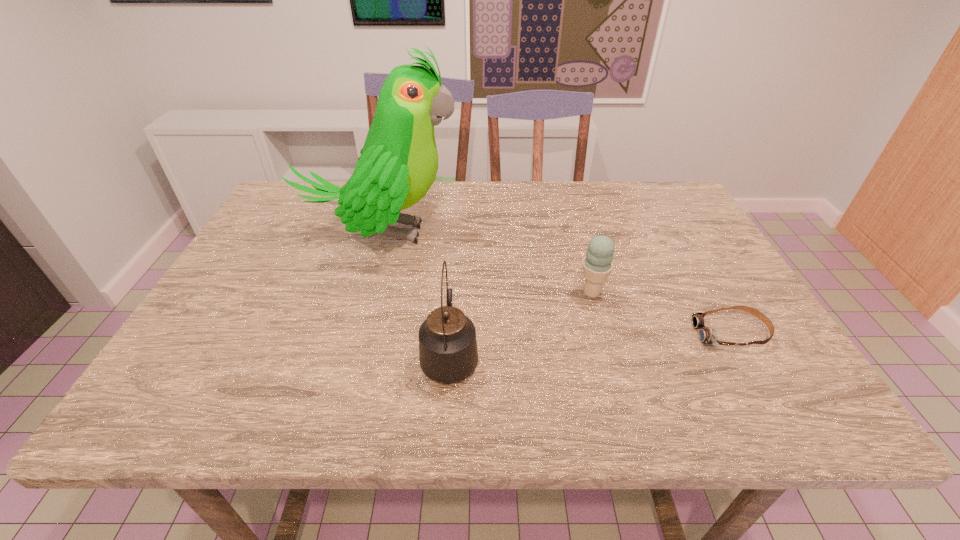
This screenshot has width=960, height=540. Find the location of `vacant space that's between the rightmost object and the second object from right to left`. vacant space that's between the rightmost object and the second object from right to left is located at coordinates (661, 313).

Identify the location of vacant area between the ice cream and the parakeet. (486, 263).

This screenshot has width=960, height=540. Find the location of `unoccupied position between the kettle and the parakeet`. unoccupied position between the kettle and the parakeet is located at coordinates (416, 294).

Locate an element on the screen. Image resolution: width=960 pixels, height=540 pixels. free space between the third tallest object and the kettle is located at coordinates (520, 324).

This screenshot has width=960, height=540. I want to click on free space between the kettle and the rightmost object, so [x=590, y=345].

The image size is (960, 540). I want to click on free space between the kettle and the third tallest object, so click(520, 324).

I want to click on object that stands as the closest to the farthest object, so click(448, 353).

Locate an element on the screen. object identified as the second closest to the tallest object is located at coordinates (598, 263).

This screenshot has height=540, width=960. What are the coordinates of `free space in the image that satisfies the following two spatial constraints: 1. spout on the second shortest object; 2. on the left side of the kettle` in the screenshot? It's located at coord(454,293).

What are the coordinates of `free space that satisfies the following two spatial constraints: 1. on the beak of the second shortest object; 2. on the right side of the parakeet` in the screenshot? It's located at (363, 293).